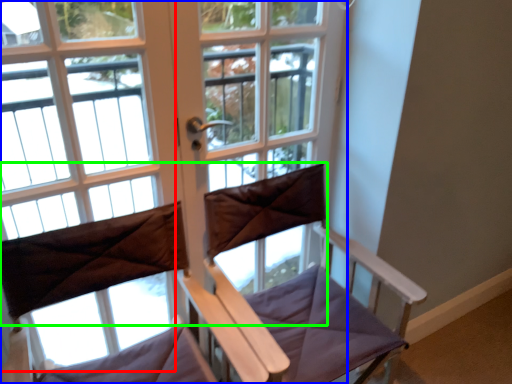
Question: Which is nearer to the bay window (highlighted by a red box)? window (highlighted by a blue box) or curtain (highlighted by a green box).

Choices:
 (A) window
 (B) curtain

Answer: (A)